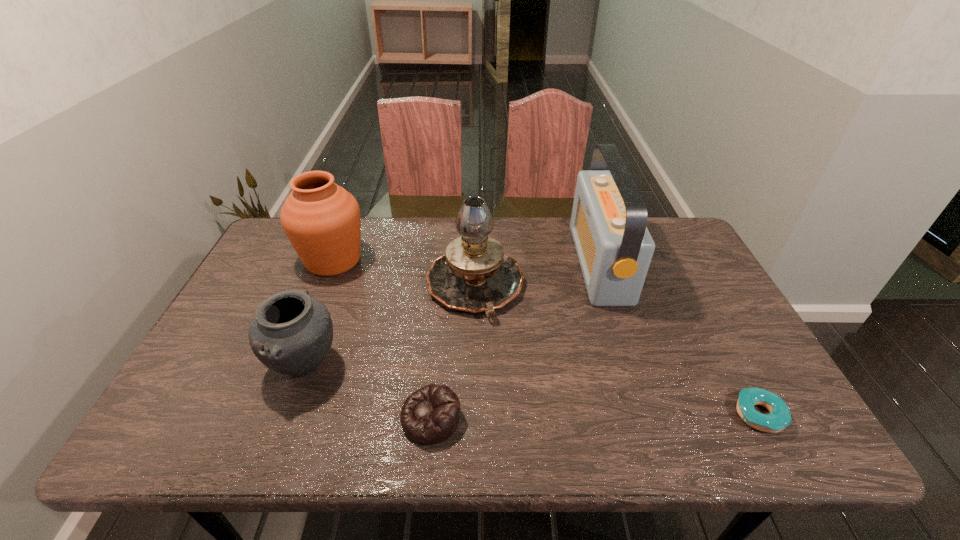
Where is `the second object from right to left`? Image resolution: width=960 pixels, height=540 pixels. the second object from right to left is located at coordinates (608, 223).

The width and height of the screenshot is (960, 540). What are the coordinates of `the farther urn` in the screenshot? It's located at (322, 221).

Locate an element on the screen. The height and width of the screenshot is (540, 960). oil lamp is located at coordinates (474, 275).

Locate an element on the screen. This screenshot has width=960, height=540. the shorter urn is located at coordinates (292, 332).

You are a GUI agent. You are given a task and a screenshot of the screen. Output one action in this format:
    pyautogui.click(x=<x>, y=<y>)
    Task: Click on the nearer urn
    This screenshot has width=960, height=540.
    Given the screenshot: What is the action you would take?
    pyautogui.click(x=292, y=332)

Where is `beanbag`? beanbag is located at coordinates (430, 415).

This screenshot has width=960, height=540. In order to click on the shortest object in this screenshot , I will do `click(779, 417)`.

You are a GUI agent. You are given a task and a screenshot of the screen. Output one action in this format:
    pyautogui.click(x=<x>, y=<y>)
    Task: Click on the doughnut
    The height and width of the screenshot is (540, 960).
    Given the screenshot: What is the action you would take?
    pyautogui.click(x=779, y=417)

What are the coordinates of `vacant space situated 0.180m on the front-facing side of the second object from right to left` in the screenshot? It's located at point(520,264).

Image resolution: width=960 pixels, height=540 pixels. I want to click on free space located 0.120m on the front-facing side of the second object from right to left, so click(x=540, y=264).